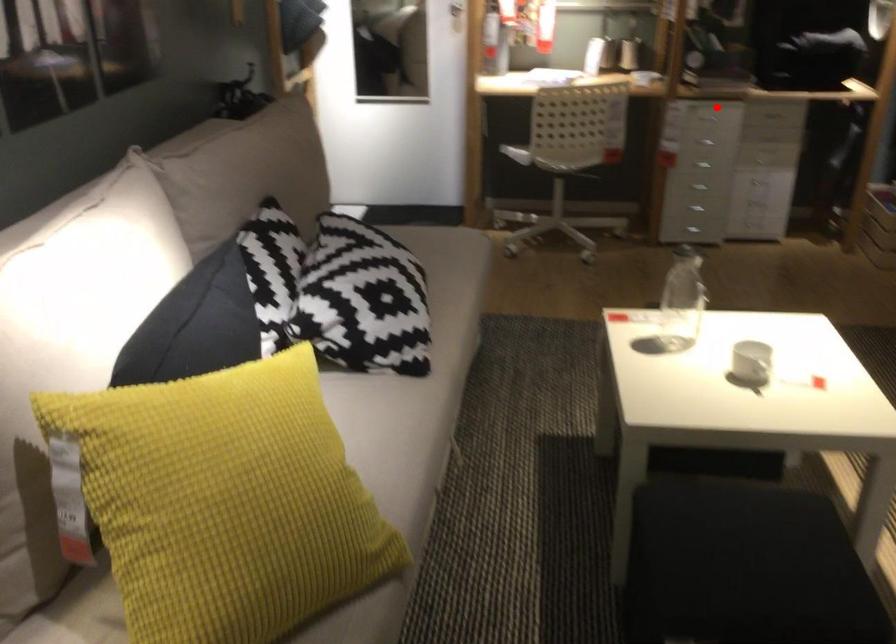
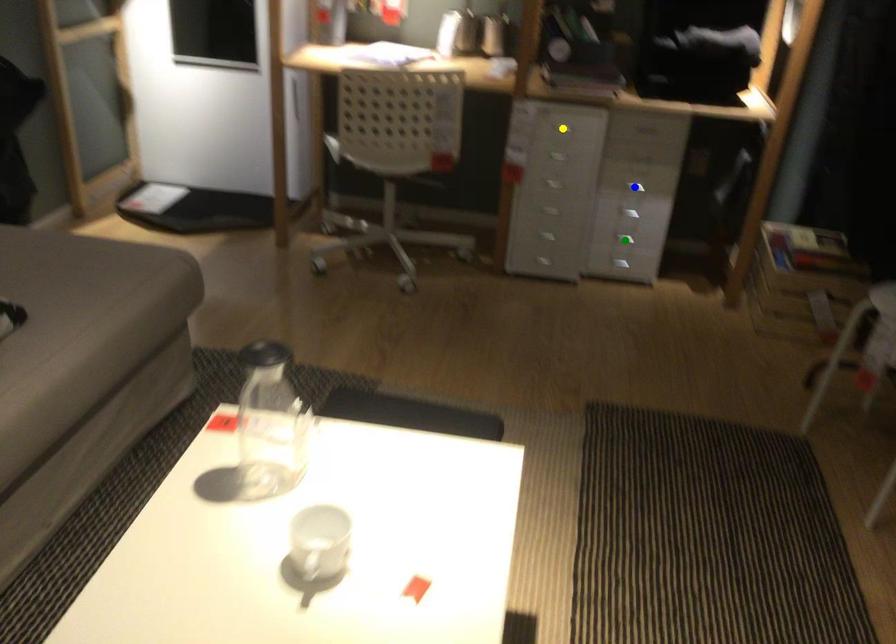
Question: I am providing you with two images of the same scene from different viewpoints. A red point is marked on the first image. You are given multiple points on the second image. Which point in image 2 represents the same 3d spot as the red point in image 1?

Choices:
 (A) yellow point
 (B) blue point
 (C) green point

Answer: (A)